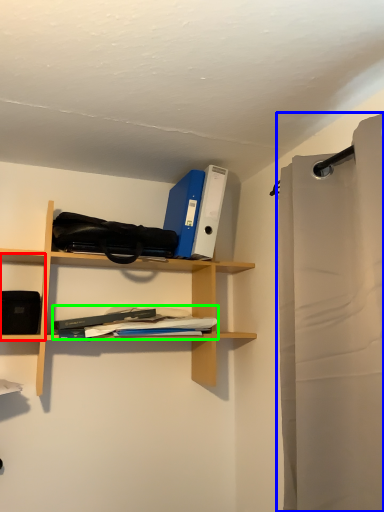
Question: Which object is the farthest from cabinet (highlighted by a red box)? Choose among these: shower curtain (highlighted by a blue box) or book (highlighted by a green box).

Choices:
 (A) shower curtain
 (B) book

Answer: (A)